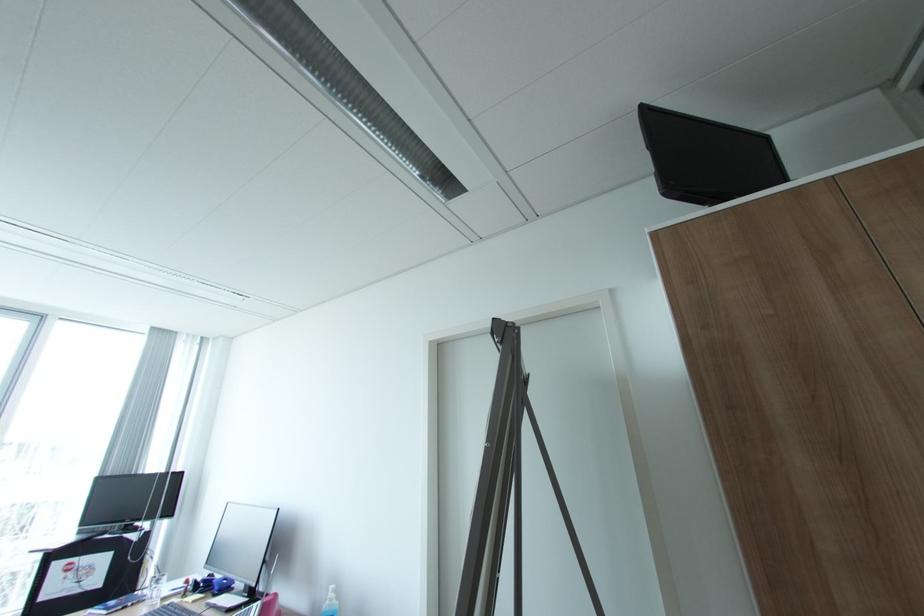
The image size is (924, 616). Describe the element at coordinates (331, 602) in the screenshot. I see `the bottle pump top` at that location.